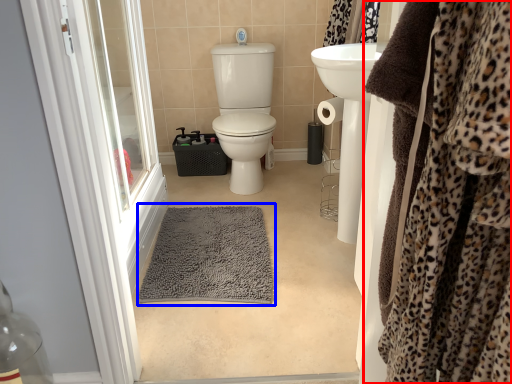
Question: Which object is closer to the camera taking this photo, clothing (highlighted by a red box) or bath mat (highlighted by a blue box)?

Choices:
 (A) clothing
 (B) bath mat

Answer: (A)